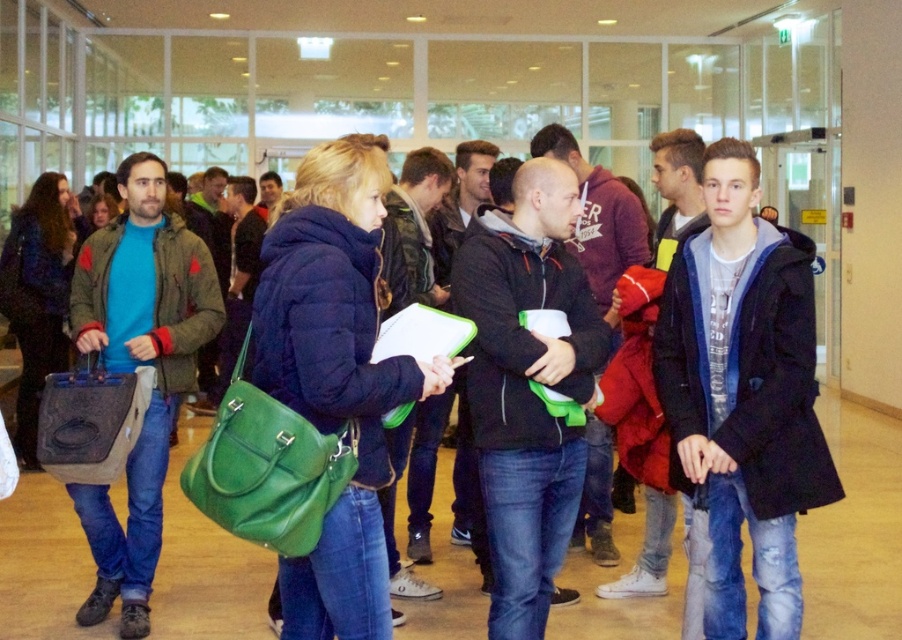
Is dark blue textured coat at center wider than matte green bag at center?

Incorrect, dark blue textured coat at center's width does not surpass matte green bag at center's.

Between point (803, 264) and point (343, 572), which one is positioned in front?

Point (343, 572)

At what (x,y) coordinates should I click in order to perform the action: click on dark blue textured coat at center. Please return your answer as a coordinate pair (x, y). The height and width of the screenshot is (640, 902). Looking at the image, I should click on (743, 394).